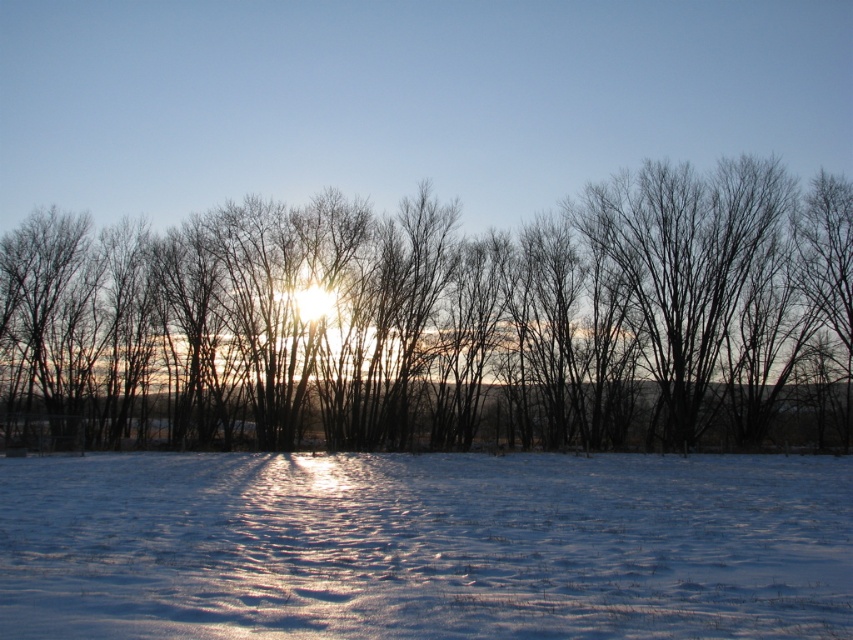
Question: Can you confirm if bare branches at center is thinner than white powdery snow at lower center?

Choices:
 (A) no
 (B) yes

Answer: (A)

Question: Which of the following is the farthest from the observer?

Choices:
 (A) white powdery snow at lower center
 (B) bare branches at center

Answer: (B)

Question: Among these objects, which one is farthest from the camera?

Choices:
 (A) white powdery snow at lower center
 (B) bare branches at center

Answer: (B)

Question: Is bare branches at center further to camera compared to white powdery snow at lower center?

Choices:
 (A) no
 (B) yes

Answer: (B)

Question: Is bare branches at center bigger than white powdery snow at lower center?

Choices:
 (A) yes
 (B) no

Answer: (A)